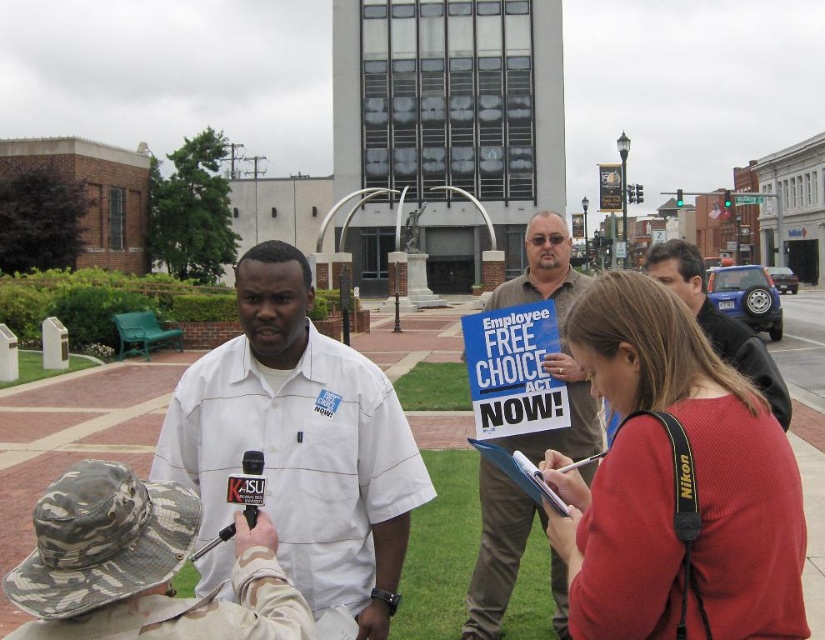
You are a photographer positioned at point A. You want to capture a photo of the protest scene. There are two points marked in the image for potential vantage points. The first point is at coordinates point (x=623, y=572) and the second is at point (x=498, y=508). Which point would allow you to see the protest scene more clearly without obstruction?

Point (x=623, y=572) is in front of point (x=498, y=508), so it would provide a clearer view of the protest scene without obstruction.

You are a photographer standing in the public square and need to capture a photo of both the red knit sweater at center and the brown paper bag at center. Which object should you focus on first to ensure both are in the frame?

Since the red knit sweater at center is not as tall as the brown paper bag at center, you should focus on the taller brown paper bag at center first to ensure both objects are fully captured in the frame.